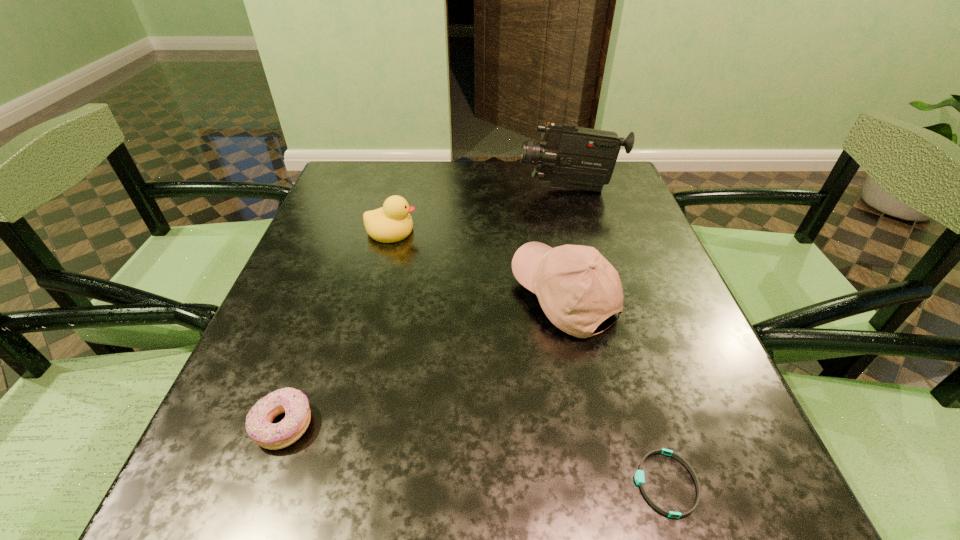
This screenshot has width=960, height=540. Identify the location of the tallest object. (572, 157).

At what (x,y) coordinates should I click in order to perform the action: click on camcorder. Please return your answer as a coordinate pair (x, y). The image size is (960, 540). Looking at the image, I should click on (572, 157).

Locate an element on the screen. the third farthest object is located at coordinates (577, 288).

Where is `baseball cap`? This screenshot has height=540, width=960. baseball cap is located at coordinates (577, 288).

Identify the location of duckling. (391, 223).

Identify the location of the third tallest object. (391, 223).

The image size is (960, 540). I want to click on the fourth tallest object, so coord(295,404).

This screenshot has height=540, width=960. In order to click on wristband in this screenshot , I will do `click(639, 476)`.

I want to click on vacant space located 0.390m on the front-facing side of the tallest object, so click(372, 189).

Where is `vacant area situated 0.300m on the front-facing side of the tallest object`? The height and width of the screenshot is (540, 960). vacant area situated 0.300m on the front-facing side of the tallest object is located at coordinates (405, 189).